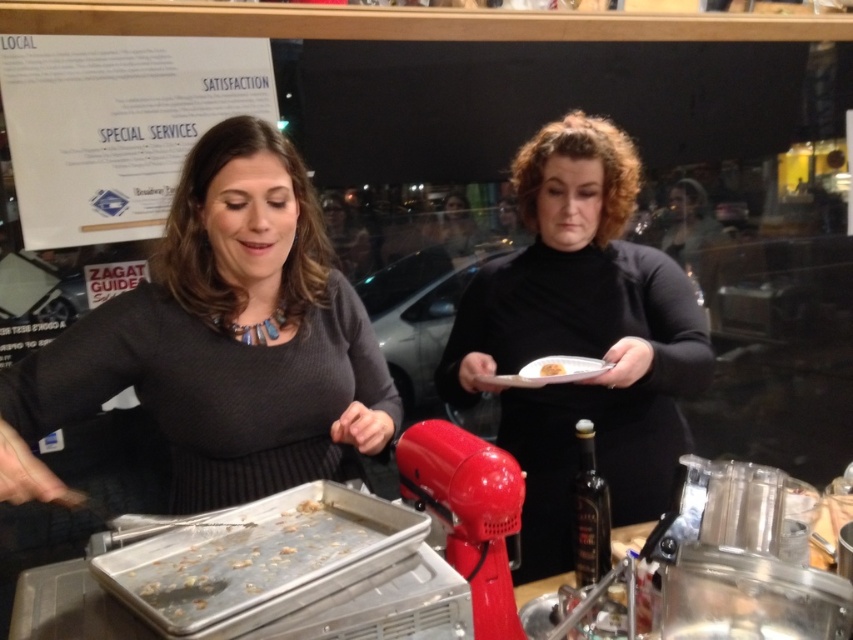
You are a customer waiting to place an order at the counter. There are two items in front of you on the counter. One is the black matte dress at center and the other is the yellow matte bread at center. Which item is closer to you?

The black matte dress at center is closer to you because it is in front of the yellow matte bread at center.

You are a chef in a busy kitchen and need to place both the black matte dress at center and the yellow matte bread at center onto a shelf that can only hold items up to 30 cm in height. Given their heights, can both items fit on the shelf?

The black matte dress at center is taller than the yellow matte bread at center. If the black matte dress at center is under 30 cm in height, both items can fit. However, if the black matte dress at center exceeds 30 cm, only the yellow matte bread at center would fit.